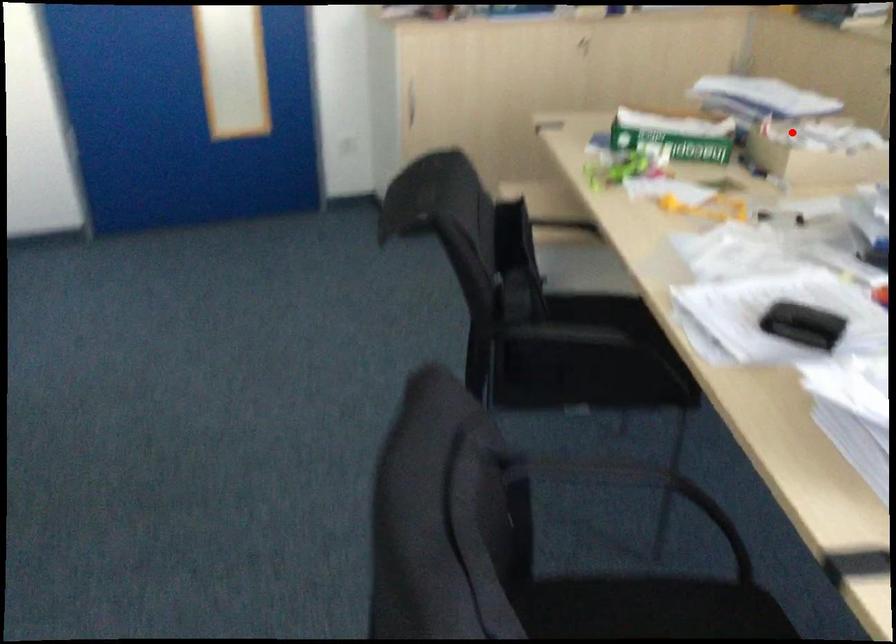
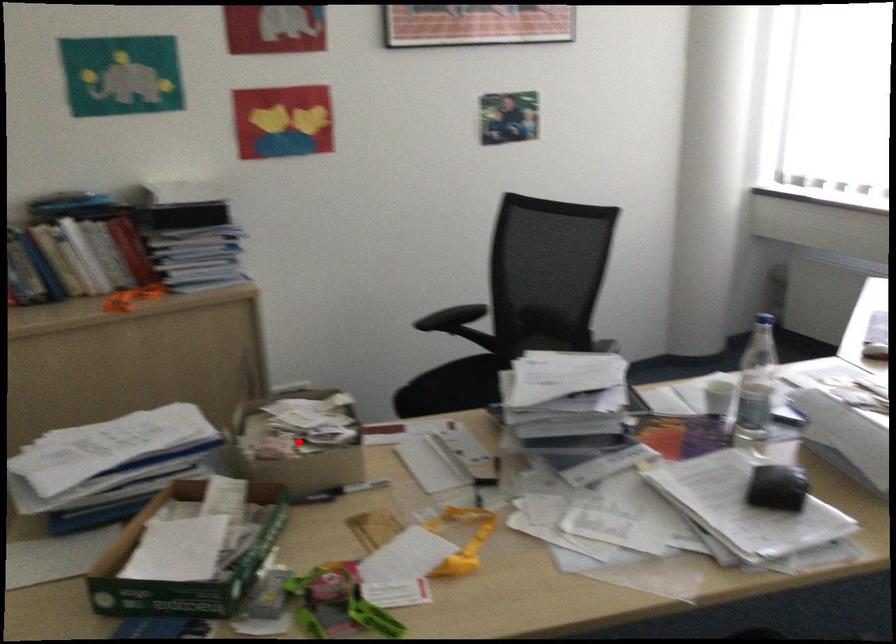
Consider the image. I am providing you with two images of the same scene from different viewpoints. A red point is marked on the first image and another point is marked on the second image. Are the points marked in image1 and image2 representing the same 3D position?

Yes